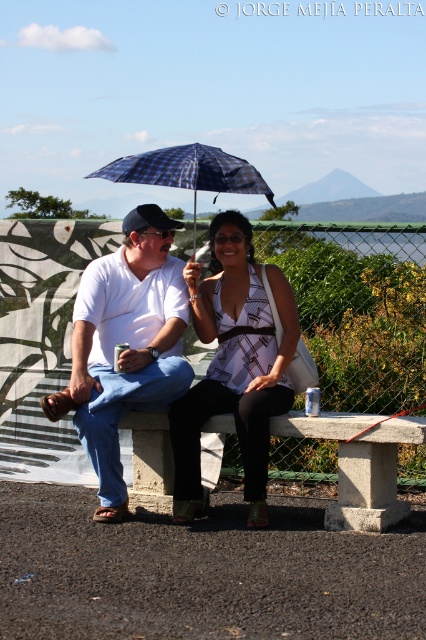
Is point (232, 244) closer to viewer compared to point (382, 488)?

That is False.

Looking at this image, does patterned fabric blouse at center appear over concrete bench at center?

Indeed, patterned fabric blouse at center is positioned over concrete bench at center.

Describe the element at coordinates (233, 364) in the screenshot. This screenshot has width=426, height=640. I see `patterned fabric blouse at center` at that location.

In order to click on patterned fabric blouse at center in this screenshot , I will do `click(233, 364)`.

Which is in front, point (287, 305) or point (94, 173)?

Positioned in front is point (287, 305).

Who is positioned more to the left, patterned fabric blouse at center or blue plaid umbrella at center?

blue plaid umbrella at center

Does point (195, 394) come behind point (218, 182)?

No, (195, 394) is closer to viewer.

Identify the location of patterned fabric blouse at center. (233, 364).

The height and width of the screenshot is (640, 426). Identify the location of matte white shirt at center. (127, 340).

Is matte white shirt at center further to camera compared to concrete bench at center?

Yes, matte white shirt at center is behind concrete bench at center.

The image size is (426, 640). In order to click on matte white shirt at center in this screenshot , I will do `click(127, 340)`.